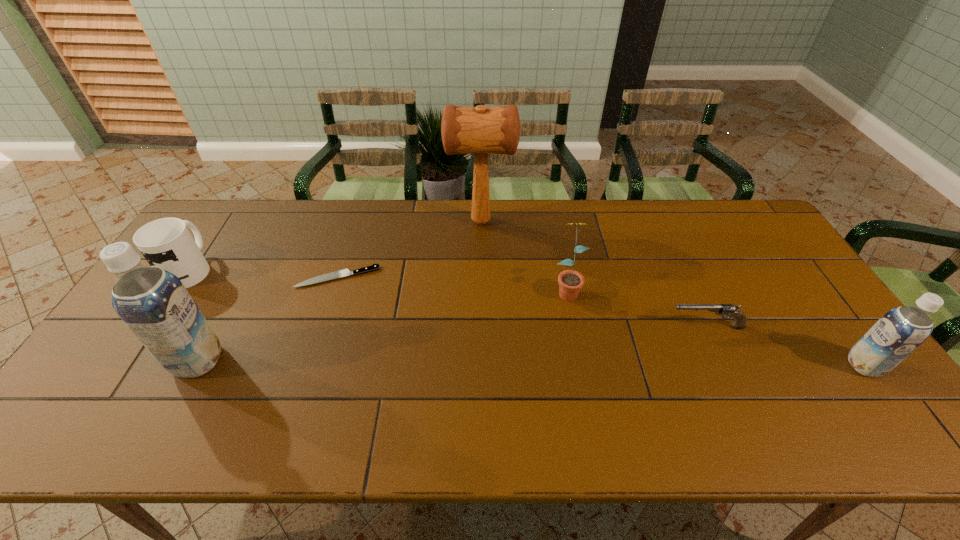
Identify the location of object that is at the right edge. This screenshot has width=960, height=540. (900, 331).

This screenshot has height=540, width=960. Find the location of `object that is positioned at the near right corner`. object that is positioned at the near right corner is located at coordinates (900, 331).

The image size is (960, 540). Identify the location of blank space at the far edge of the desktop. (494, 214).

In the image, there is a desktop. Where is `vacant space at the near edge`? vacant space at the near edge is located at coordinates (439, 383).

Find the location of a particular element. The height and width of the screenshot is (540, 960). blank area at the right edge is located at coordinates (774, 316).

The height and width of the screenshot is (540, 960). I want to click on vacant space at the near left corner of the desktop, so click(93, 398).

Locate an element on the screen. unoccupied area between the shorter soya milk and the third shortest object is located at coordinates (527, 318).

Identify the location of free point between the sunflower and the leftmost object. (378, 279).

You are a GUI agent. You are given a task and a screenshot of the screen. Output one action in this format:
    pyautogui.click(x=<x>, y=<y>)
    Task: Click on the unoccupied area between the shorter soya milk and the taller soya milk
    
    Given the screenshot: What is the action you would take?
    pyautogui.click(x=531, y=363)

I want to click on free space that is in between the fourth object from left to right and the left soya milk, so click(339, 291).